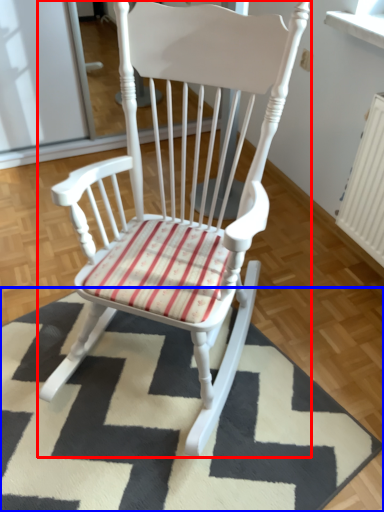
Question: Which object is closer to the camera taking this photo, chair (highlighted by a red box) or mat (highlighted by a blue box)?

Choices:
 (A) chair
 (B) mat

Answer: (A)